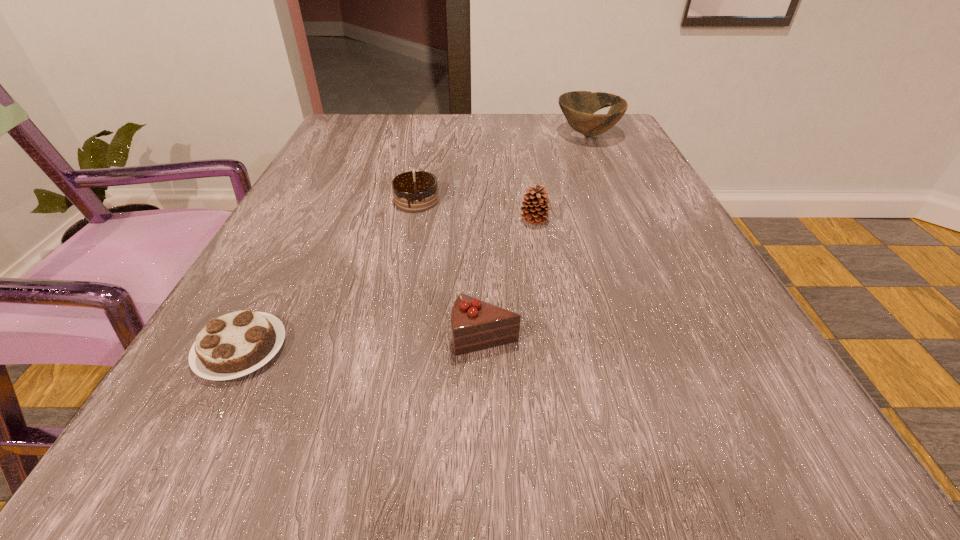
The image size is (960, 540). I want to click on free space located on the back of the pinecone, so click(520, 134).

At what (x,y) coordinates should I click in order to perform the action: click on vacant point located 0.200m on the back of the fourth nearest object. Please return your answer as a coordinate pair (x, y). This screenshot has width=960, height=540. Looking at the image, I should click on (427, 147).

Image resolution: width=960 pixels, height=540 pixels. What are the coordinates of `free space located 0.090m on the right of the third object from left to right` in the screenshot? It's located at (585, 337).

Locate an element on the screen. The image size is (960, 540). free location located on the right of the shortest object is located at coordinates (504, 349).

At what (x,y) coordinates should I click in order to perform the action: click on object located at the far edge. Please return your answer as a coordinate pair (x, y). The image size is (960, 540). Looking at the image, I should click on (578, 107).

Locate an element on the screen. This screenshot has height=540, width=960. object positioned at the left edge is located at coordinates (235, 344).

This screenshot has height=540, width=960. I want to click on object that is at the right edge, so click(x=578, y=107).

Where is `object present at the far right corner`? Image resolution: width=960 pixels, height=540 pixels. object present at the far right corner is located at coordinates (578, 107).

At what (x,y) coordinates should I click in order to perform the action: click on vacant space at the far edge of the desktop. Please return your answer as a coordinate pair (x, y). The image size is (960, 540). Looking at the image, I should click on (548, 119).

Image resolution: width=960 pixels, height=540 pixels. I want to click on vacant space at the near edge, so click(595, 471).